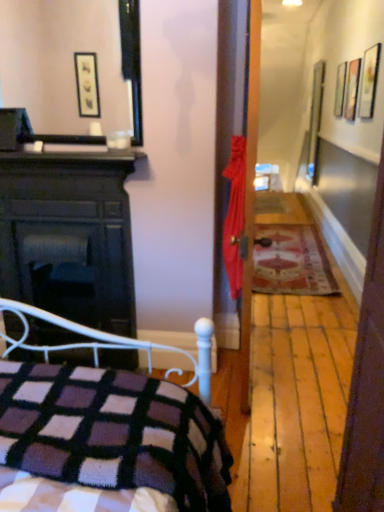
Question: In terms of size, does dark wood fireplace at left appear bigger or smaller than carpeted mat at hallway center?

Choices:
 (A) small
 (B) big

Answer: (B)

Question: In terms of height, does dark wood fireplace at left look taller or shorter compared to carpeted mat at hallway center?

Choices:
 (A) tall
 (B) short

Answer: (A)

Question: Which object is the farthest from the dark wood fireplace at left?

Choices:
 (A) knitted wool blanket at lower left
 (B) wooden picture frame at upper right
 (C) carpeted mat at hallway center

Answer: (B)

Question: Based on their relative distances, which object is farther from the wooden picture frame at upper right?

Choices:
 (A) carpeted mat at hallway center
 (B) dark wood fireplace at left
 (C) knitted wool blanket at lower left

Answer: (C)